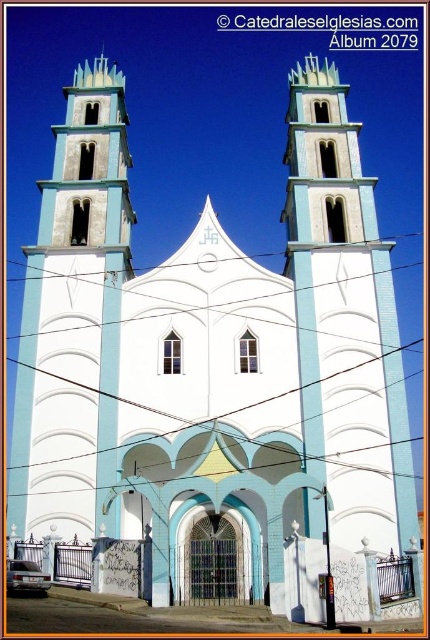
From the picture: You are standing in front of the church and want to take a photo focusing on the light blue stone tower at center. To ensure it is centered in your viewfinder, where should you position the tower relative to the frame?

The light blue stone tower at center is located at point (344, 321) in the frame, so positioning it near the center horizontally and slightly lower vertically would center it in the viewfinder.

You are an architect assessing the church facade. You notice the light blue stone tower at center and the white smooth tower at center. Which tower would require less material to construct based on their sizes?

The light blue stone tower at center has a smaller size compared to the white smooth tower at center, so it would require less material to construct.

You are a maintenance worker needing to inspect both the light blue stone tower at center and the white smooth tower at center. Given that your ladder can only reach up to 60 feet, can you safely reach both towers without needing a taller ladder?

The distance between the light blue stone tower at center and the white smooth tower at center is 67.14 feet, which is greater than the ladder capacity of 60 feet. Therefore, you cannot safely reach both towers with the current ladder.